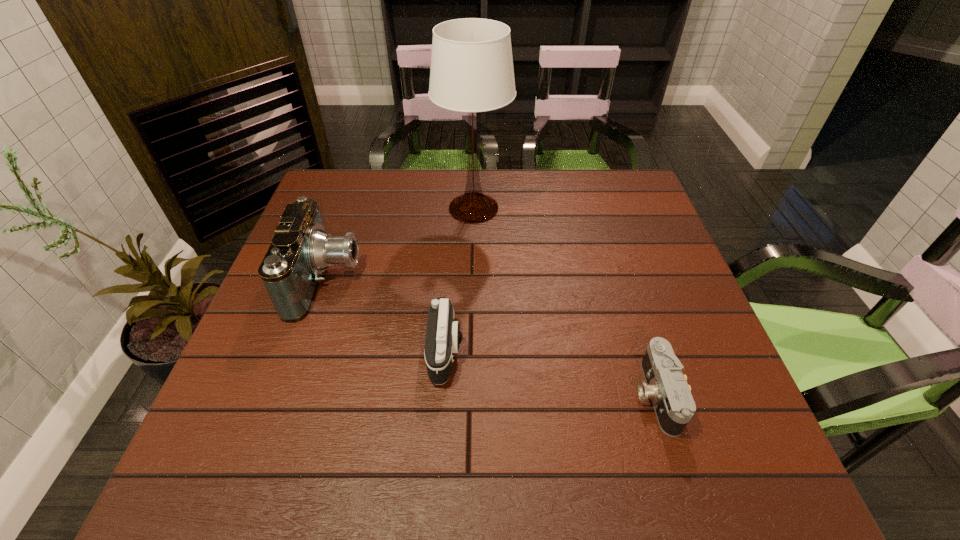
This screenshot has height=540, width=960. What are the coordinates of `table lamp` in the screenshot? It's located at (471, 71).

The width and height of the screenshot is (960, 540). What are the coordinates of `the farthest object` in the screenshot? It's located at (471, 71).

This screenshot has height=540, width=960. I want to click on camcorder, so click(291, 270).

Locate an element on the screen. the leftmost object is located at coordinates (291, 270).

Where is `the taller camera`? the taller camera is located at coordinates (443, 336).

Where is `the second shortest object`? The height and width of the screenshot is (540, 960). the second shortest object is located at coordinates (443, 336).

Where is `the shorter camera`? the shorter camera is located at coordinates (666, 386).

This screenshot has height=540, width=960. I want to click on the rightmost object, so click(x=666, y=386).

You are a GUI agent. You are given a task and a screenshot of the screen. Output one action in this format:
    pyautogui.click(x=<x>, y=<y>)
    Task: Click on the vacant space located above the cylindrical shade of the farthest object
    
    Given the screenshot: What is the action you would take?
    pyautogui.click(x=537, y=208)

Where is `vacant space located on the front-facing side of the second tallest object`? The image size is (960, 540). vacant space located on the front-facing side of the second tallest object is located at coordinates (444, 280).